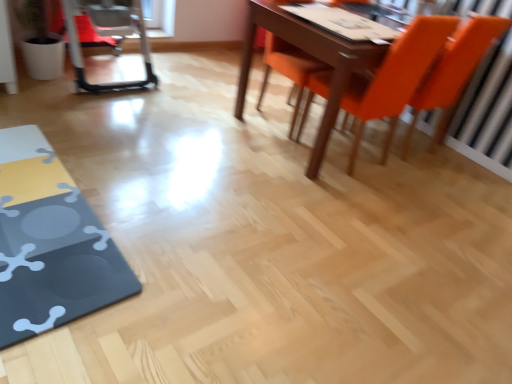
Question: Is metallic silver swivel chair at left directly adjacent to orange matte chair at upper right, which appears as the third chair when viewed from the right?

Choices:
 (A) yes
 (B) no

Answer: (B)

Question: Is metallic silver swivel chair at left taller than orange matte chair at upper right, the 1th chair when ordered from left to right?

Choices:
 (A) yes
 (B) no

Answer: (B)

Question: Is metallic silver swivel chair at left outside of orange matte chair at upper right, the 1th chair when ordered from left to right?

Choices:
 (A) no
 (B) yes

Answer: (B)

Question: Is orange matte chair at upper right, which appears as the third chair when viewed from the right, a part of metallic silver swivel chair at left?

Choices:
 (A) no
 (B) yes

Answer: (A)

Question: Is the position of metallic silver swivel chair at left more distant than that of orange matte chair at upper right, which appears as the third chair when viewed from the right?

Choices:
 (A) yes
 (B) no

Answer: (A)

Question: Considering their positions, is matte black table at lower left located in front of or behind metallic silver swivel chair at left?

Choices:
 (A) behind
 (B) front

Answer: (B)

Question: Considering the positions of point (93, 261) and point (118, 26), is point (93, 261) closer or farther from the camera than point (118, 26)?

Choices:
 (A) farther
 (B) closer

Answer: (B)

Question: Is matte black table at lower left spatially inside metallic silver swivel chair at left, or outside of it?

Choices:
 (A) inside
 (B) outside

Answer: (B)

Question: Considering the positions of matte black table at lower left and metallic silver swivel chair at left in the image, is matte black table at lower left taller or shorter than metallic silver swivel chair at left?

Choices:
 (A) short
 (B) tall

Answer: (A)

Question: In terms of height, does matte black table at lower left look taller or shorter compared to orange matte chair at upper right, the 2th chair positioned from the right?

Choices:
 (A) short
 (B) tall

Answer: (A)

Question: Is point (86, 248) closer or farther from the camera than point (368, 102)?

Choices:
 (A) farther
 (B) closer

Answer: (B)

Question: From the image's perspective, relative to orange matte chair at upper right, acting as the second chair starting from the left, is matte black table at lower left above or below?

Choices:
 (A) below
 (B) above

Answer: (A)

Question: Based on their sizes in the image, would you say matte black table at lower left is bigger or smaller than orange matte chair at upper right, acting as the second chair starting from the left?

Choices:
 (A) big
 (B) small

Answer: (B)

Question: From a real-world perspective, is orange matte chair at upper right, acting as the second chair starting from the left, positioned above or below matte black table at lower left?

Choices:
 (A) above
 (B) below

Answer: (A)

Question: Visually, is orange matte chair at upper right, acting as the second chair starting from the left, positioned to the left or to the right of matte black table at lower left?

Choices:
 (A) left
 (B) right

Answer: (B)